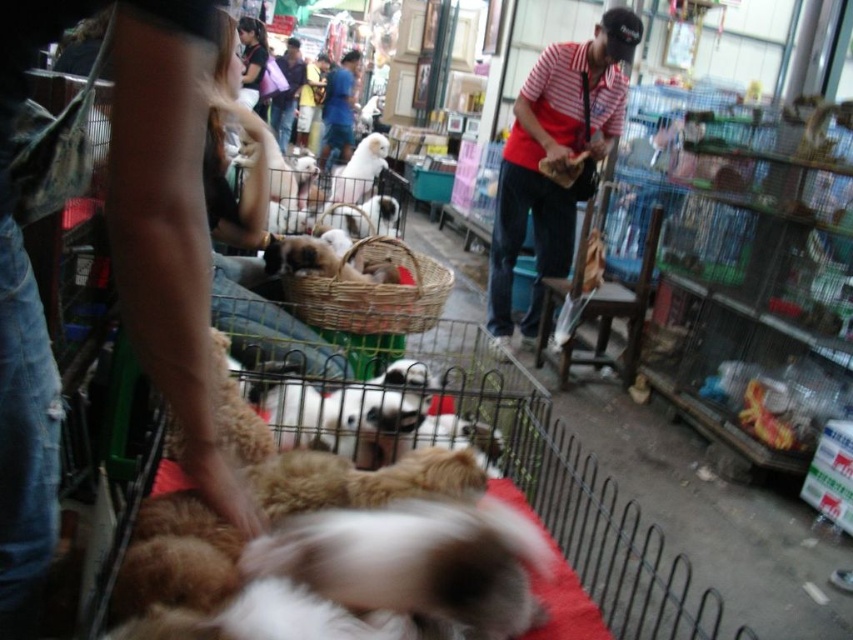
Can you confirm if red striped shirt at center is positioned to the left of blue denim shorts at center?

No, red striped shirt at center is not to the left of blue denim shorts at center.

Image resolution: width=853 pixels, height=640 pixels. Identify the location of red striped shirt at center. (554, 160).

Can you confirm if dark blue shirt at center is smaller than dark blue shirt at upper center?

Actually, dark blue shirt at center might be larger than dark blue shirt at upper center.

At what (x,y) coordinates should I click in order to perform the action: click on dark blue shirt at center. Please return your answer as a coordinate pair (x, y). The image size is (853, 640). Looking at the image, I should click on (286, 92).

Where is `dark blue shirt at center`? The image size is (853, 640). dark blue shirt at center is located at coordinates (286, 92).

Looking at this image, is fluffy brown dog at center below blue denim shorts at center?

Indeed, fluffy brown dog at center is positioned under blue denim shorts at center.

Does point (252, 630) come in front of point (335, 140)?

Yes, it is.

Which is behind, point (219, 579) or point (360, 52)?

Point (360, 52)

The height and width of the screenshot is (640, 853). I want to click on fluffy brown dog at center, so click(x=335, y=556).